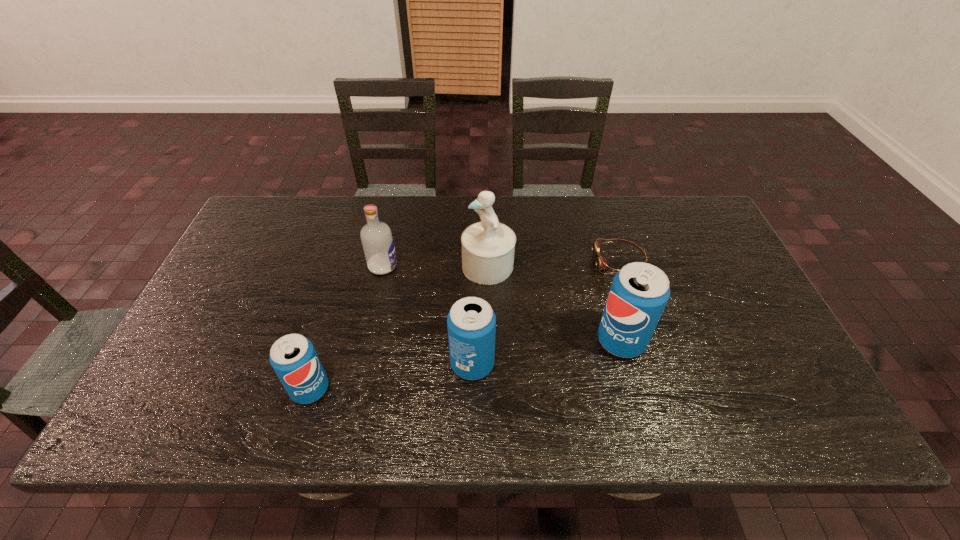
Identify the location of free area in between the leftmost object and the second shortest soda can. This screenshot has height=540, width=960. (392, 376).

Where is `object that can be found as the fourth closest to the second tallest soda can`? This screenshot has height=540, width=960. object that can be found as the fourth closest to the second tallest soda can is located at coordinates (377, 240).

Select which object is the closest to the shortest object. Please provide its 2D coordinates. Your answer should be formatted as a tuple, i.e. [(x, y)], where the tuple contains the x and y coordinates of a point satisfying the conditions above.

[(639, 292)]

Identify which soda can is located as the second nearest to the second tallest soda can. Please provide its 2D coordinates. Your answer should be formatted as a tuple, i.e. [(x, y)], where the tuple contains the x and y coordinates of a point satisfying the conditions above.

[(293, 357)]

Identify which soda can is located as the second nearest to the shortest object. Please provide its 2D coordinates. Your answer should be formatted as a tuple, i.e. [(x, y)], where the tuple contains the x and y coordinates of a point satisfying the conditions above.

[(471, 322)]

Image resolution: width=960 pixels, height=540 pixels. I want to click on free region that satisfies the following two spatial constraints: 1. on the label of the second object from left to right; 2. on the right side of the rightmost soda can, so click(367, 341).

The width and height of the screenshot is (960, 540). I want to click on free space that satisfies the following two spatial constraints: 1. on the back side of the rightmost soda can; 2. on the label of the fifth object from right to left, so click(x=601, y=266).

Identify the location of blank space that satisfies the following two spatial constraints: 1. on the label of the vodka; 2. on the back side of the rightmost soda can. (367, 341).

Locate an element on the screen. free space that satisfies the following two spatial constraints: 1. on the label of the second object from left to right; 2. on the left side of the rightmost soda can is located at coordinates (367, 341).

Locate an element on the screen. The image size is (960, 540). vacant space that satisfies the following two spatial constraints: 1. on the label of the second soda can from left to right; 2. on the right side of the fifth object from right to left is located at coordinates (362, 364).